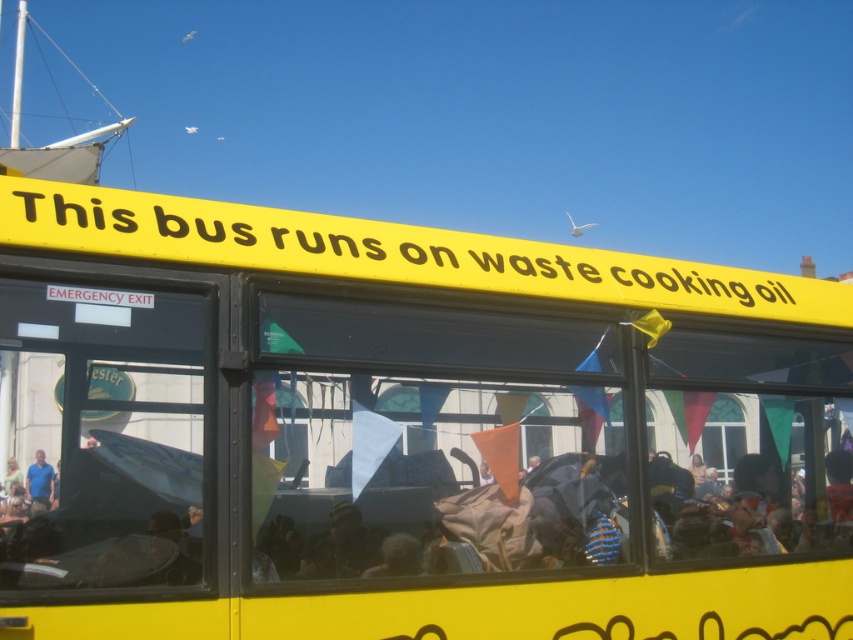
What do you see at coordinates (437, 518) in the screenshot?
I see `matte black backpack at center` at bounding box center [437, 518].

Locate an element on the screen. Image resolution: width=853 pixels, height=640 pixels. matte black backpack at center is located at coordinates (437, 518).

Is yellow matte bus at center below matte black backpack at center?

No, yellow matte bus at center is not below matte black backpack at center.

Which is in front, point (202, 234) or point (717, 552)?

Point (202, 234) is more forward.

Which is in front, point (13, 188) or point (265, 552)?

Point (13, 188) is in front.

The width and height of the screenshot is (853, 640). Identify the location of yellow matte bus at center. (409, 432).

Is yellow matte sign at upper center above matte blue shirt at lower left?

Yes, yellow matte sign at upper center is above matte blue shirt at lower left.

Between yellow matte sign at upper center and matte blue shirt at lower left, which one appears on the left side from the viewer's perspective?

matte blue shirt at lower left

Which is behind, point (227, 237) or point (35, 486)?

The point (35, 486) is behind.

You are a GUI agent. You are given a task and a screenshot of the screen. Output one action in this format:
    pyautogui.click(x=<x>, y=<y>)
    Task: Click on the yellow matte sign at upper center
    Image resolution: width=853 pixels, height=640 pixels.
    Given the screenshot: What is the action you would take?
    pyautogui.click(x=374, y=250)